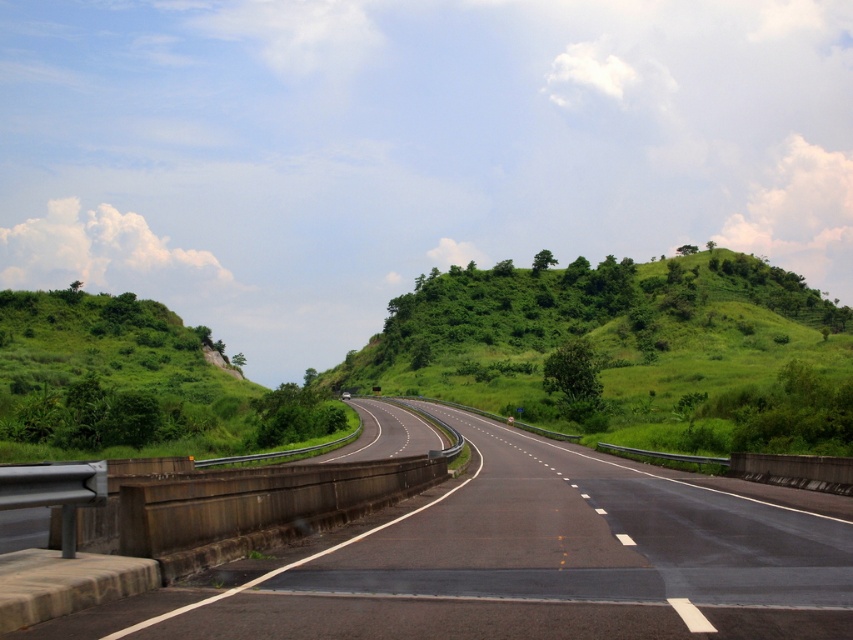
You are driving a car and see the black asphalt highway at center and the green grassy hillside at center. Which one is closer to you from your driving perspective?

The black asphalt highway at center is positioned under green grassy hillside at center, so the black asphalt highway at center is closer to you.

You are standing on the side of the road and want to cross the black asphalt highway at center. Given that the highway is 20.68 feet away from you, can you safely cross it without stepping into the road?

The black asphalt highway at center is 20.68 feet away from the viewer. Since the road is marked with lane lines and has barriers, you should use a designated crosswalk or wait for a safe gap in traffic before attempting to cross. However, the distance alone does not guarantee safety, so proceed with caution.

You are driving a car and see the black asphalt highway at center and the green grassy hillside at center. Which one is closer to you?

The black asphalt highway at center is closer to you because it is in front of the green grassy hillside at center.